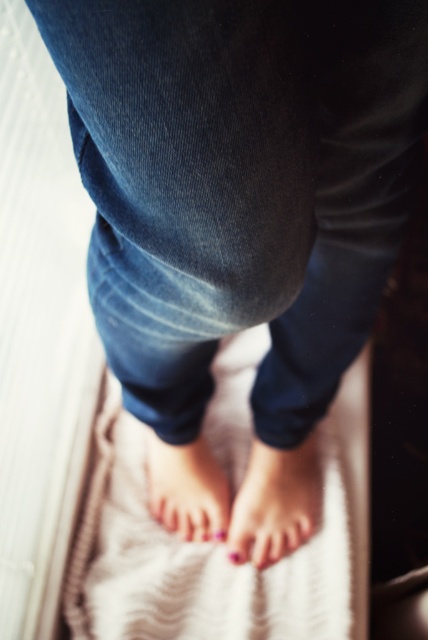
Does textured beige mat at center have a lesser width compared to pink matte toe at center?

Incorrect, textured beige mat at center's width is not less than pink matte toe at center's.

Which is in front, point (359, 524) or point (243, 556)?

Point (243, 556) is in front.

Which is behind, point (196, 573) or point (238, 554)?

The point (238, 554) is more distant.

You are a GUI agent. You are given a task and a screenshot of the screen. Output one action in this format:
    pyautogui.click(x=<x>, y=<y>)
    Task: Click on the textured beige mat at center
    The height and width of the screenshot is (640, 428).
    Given the screenshot: What is the action you would take?
    pyautogui.click(x=217, y=547)

Consider the image. Who is shorter, textured beige mat at center or pink polished toenails at lower center?

With less height is pink polished toenails at lower center.

From the picture: Between textured beige mat at center and pink polished toenails at lower center, which one is positioned higher?

textured beige mat at center

Who is more distant from viewer, (139, 586) or (226, 493)?

The point (226, 493) is more distant.

Identify the location of textured beige mat at center. Image resolution: width=428 pixels, height=640 pixels. (217, 547).

In the scene shown: Is textured beige mat at center thinner than nail-polished skin at lower center?

No.

Is textured beige mat at center closer to the viewer compared to nail-polished skin at lower center?

Yes, it is.

Measure the distance between point (288, 625) and camera.

Point (288, 625) is 88.94 centimeters away from camera.

Find the location of a particular element. Image resolution: width=428 pixels, height=640 pixels. textured beige mat at center is located at coordinates (217, 547).